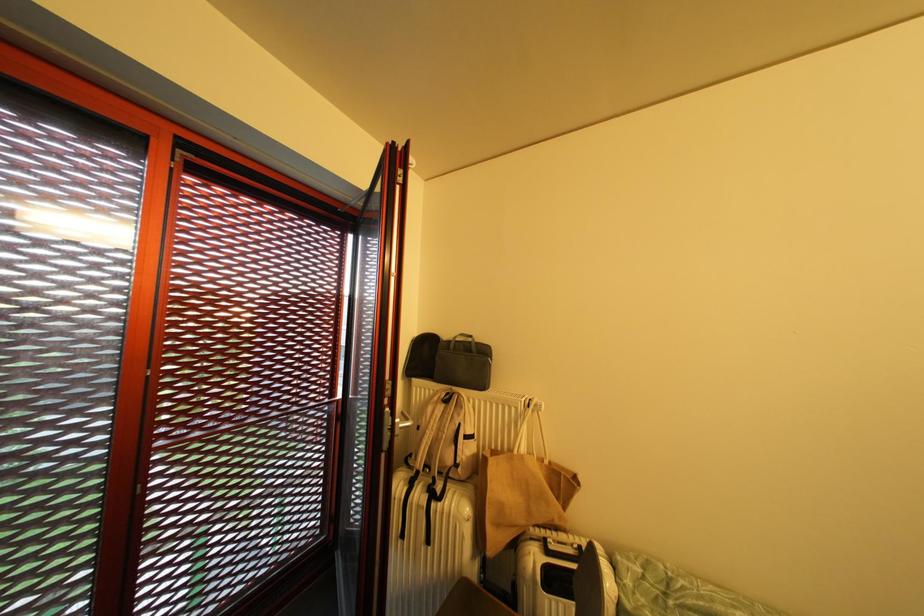
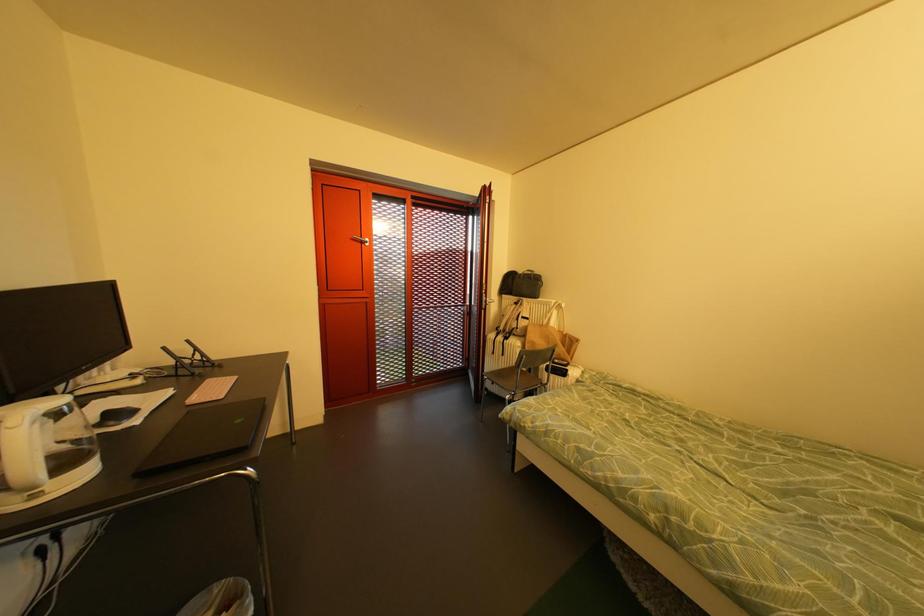
Which direction would the cameraman need to move to produce the second image?

The cameraman moved toward right, backward.